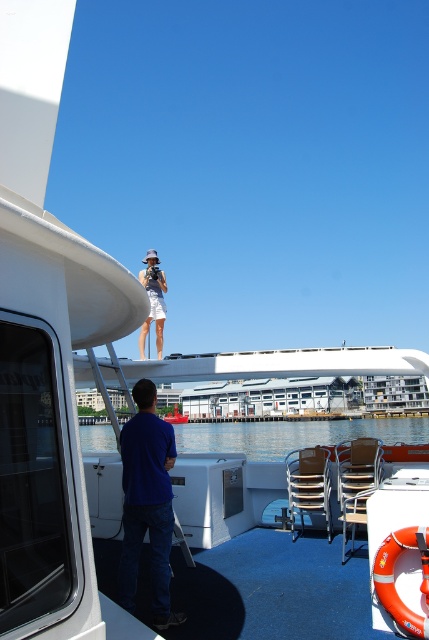
Question: Which of the following is the closest to the observer?

Choices:
 (A) (175, 420)
 (B) (157, 305)
 (C) (135, 392)

Answer: (C)

Question: Is matte white skirt at upper center below light blue plastic boat at center?

Choices:
 (A) yes
 (B) no

Answer: (B)

Question: Which point is closer to the camera taking this photo?

Choices:
 (A) (250, 433)
 (B) (178, 422)
 (C) (151, 280)
 (D) (165, 472)

Answer: (D)

Question: Among these objects, which one is farthest from the camera?

Choices:
 (A) blue cotton shirt at lower left
 (B) matte white skirt at upper center
 (C) blue water at lower center

Answer: (C)

Question: Observing the image, what is the correct spatial positioning of blue cotton shirt at lower left in reference to light blue plastic boat at center?

Choices:
 (A) below
 (B) above

Answer: (B)

Question: Can you confirm if blue cotton shirt at lower left is wider than blue water at lower center?

Choices:
 (A) no
 (B) yes

Answer: (A)